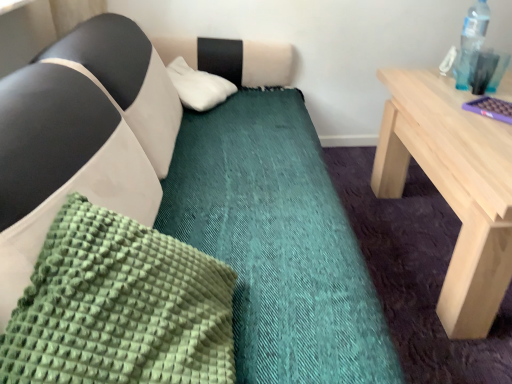
Question: Is green textured pillow at lower left, the 1th pillow from the bottom, wider than transparent plastic bottle at upper right?

Choices:
 (A) no
 (B) yes

Answer: (B)

Question: Can you confirm if green textured pillow at lower left, the 1th pillow from the bottom, is positioned to the left of transparent plastic bottle at upper right?

Choices:
 (A) no
 (B) yes

Answer: (B)

Question: Does green textured pillow at lower left, arranged as the 1th pillow when viewed from the front, have a larger size compared to transparent plastic bottle at upper right?

Choices:
 (A) yes
 (B) no

Answer: (A)

Question: Is green textured pillow at lower left, arranged as the 1th pillow when viewed from the front, further to camera compared to transparent plastic bottle at upper right?

Choices:
 (A) yes
 (B) no

Answer: (B)

Question: Is green textured pillow at lower left, the 1th pillow from the bottom, touching transparent plastic bottle at upper right?

Choices:
 (A) no
 (B) yes

Answer: (A)

Question: In terms of height, does green textured pillow at lower left, the 1th pillow from the bottom, look taller or shorter compared to white fluffy pillow at upper center, marked as the first pillow in a back-to-front arrangement?

Choices:
 (A) short
 (B) tall

Answer: (B)

Question: Is green textured pillow at lower left, which appears as the 2th pillow when viewed from the back, situated inside white fluffy pillow at upper center, which is the 1th pillow from top to bottom, or outside?

Choices:
 (A) outside
 (B) inside

Answer: (A)

Question: Relative to white fluffy pillow at upper center, the second pillow when ordered from front to back, is green textured pillow at lower left, arranged as the 1th pillow when viewed from the front, in front or behind?

Choices:
 (A) behind
 (B) front

Answer: (B)

Question: In the image, is green textured pillow at lower left, which appears as the 2th pillow when viewed from the back, on the left side or the right side of white fluffy pillow at upper center, marked as the first pillow in a back-to-front arrangement?

Choices:
 (A) right
 (B) left

Answer: (A)

Question: In terms of width, does white fluffy pillow at upper center, the second pillow when ordered from front to back, look wider or thinner when compared to transparent plastic bottle at upper right?

Choices:
 (A) thin
 (B) wide

Answer: (B)

Question: From a real-world perspective, is white fluffy pillow at upper center, the second pillow when ordered from front to back, physically located above or below transparent plastic bottle at upper right?

Choices:
 (A) below
 (B) above

Answer: (A)

Question: Does point (214, 77) appear closer or farther from the camera than point (467, 44)?

Choices:
 (A) closer
 (B) farther

Answer: (B)

Question: From the image's perspective, relative to transparent plastic bottle at upper right, is white fluffy pillow at upper center, the second pillow when ordered from front to back, above or below?

Choices:
 (A) below
 (B) above

Answer: (A)

Question: Would you say green textured pillow at lower left, placed as the second pillow when sorted from top to bottom, is to the left or to the right of transparent plastic bottle at upper right in the picture?

Choices:
 (A) left
 (B) right

Answer: (A)

Question: Considering the positions of green textured pillow at lower left, placed as the second pillow when sorted from top to bottom, and transparent plastic bottle at upper right in the image, is green textured pillow at lower left, placed as the second pillow when sorted from top to bottom, taller or shorter than transparent plastic bottle at upper right?

Choices:
 (A) short
 (B) tall

Answer: (A)